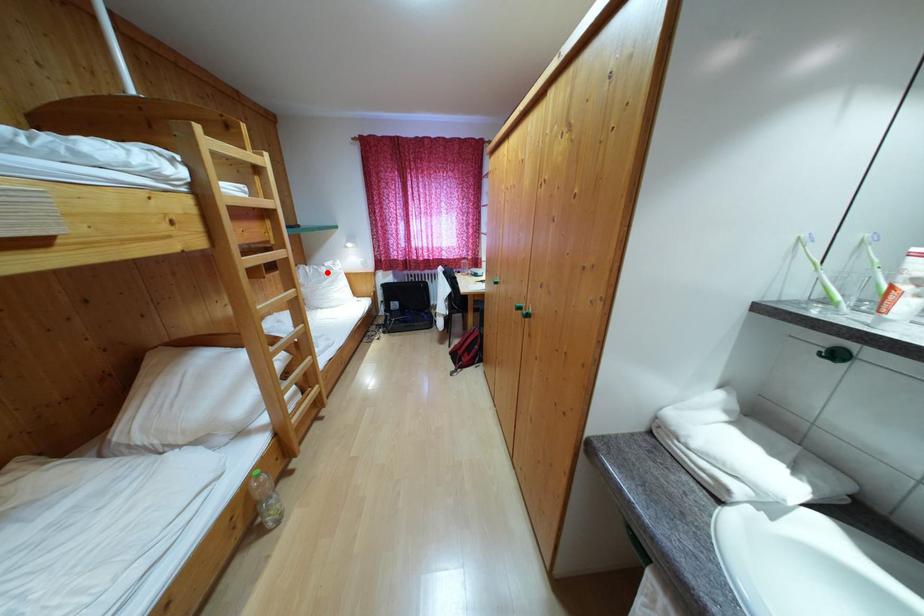
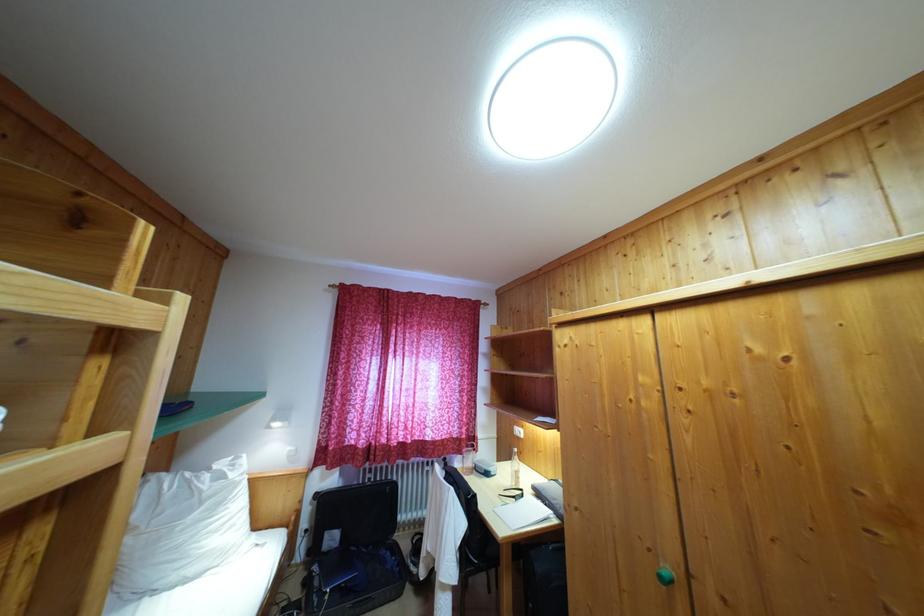
Question: I am providing you with two images of the same scene from different viewpoints. Image1 has a red point marked. In image2, the corresponding 3D location appears at what relative position? Reply with the corresponding letter.

Choices:
 (A) Closer
 (B) Farther

Answer: (B)